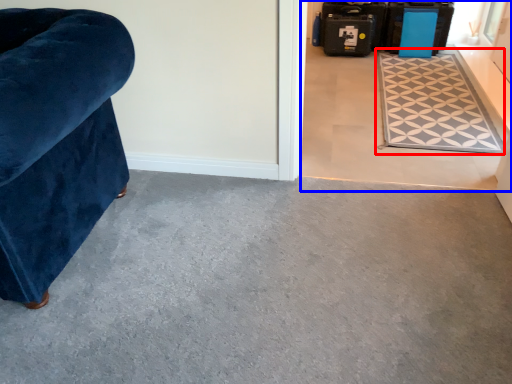
Question: Which of the following is the closest to the observer, mat (highlighted by a red box) or concrete (highlighted by a blue box)?

Choices:
 (A) mat
 (B) concrete

Answer: (B)